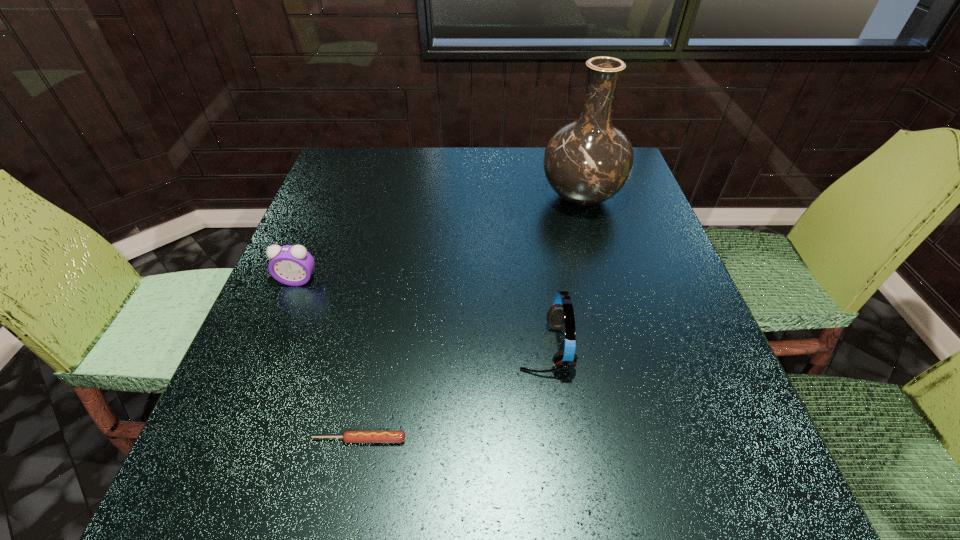
The image size is (960, 540). What are the coordinates of `free region at the left edge` in the screenshot? It's located at (322, 354).

Identify the location of vacant space at the right edge of the desktop. The width and height of the screenshot is (960, 540). (636, 245).

Find the location of `free space at the far left corner`. free space at the far left corner is located at coordinates (360, 167).

What are the coordinates of `empty location between the shortest object and the third farthest object` in the screenshot? It's located at (452, 393).

Where is `vacant area that lies between the sausage and the third shortest object`? The width and height of the screenshot is (960, 540). vacant area that lies between the sausage and the third shortest object is located at coordinates (452, 393).

Where is `empty space between the headset and the sausage`? The width and height of the screenshot is (960, 540). empty space between the headset and the sausage is located at coordinates (452, 393).

Where is `free space between the second farthest object and the tallest object`? free space between the second farthest object and the tallest object is located at coordinates (440, 239).

What are the coordinates of `vacant area that lies between the farthest object and the nearest object` in the screenshot? It's located at (470, 318).

Identify the location of vacant space that's between the headset and the third nearest object. The image size is (960, 540). (421, 314).

At what (x,y) coordinates should I click in order to perform the action: click on vacant point located between the tallest object and the sausage. Please return your answer as a coordinate pair (x, y). The height and width of the screenshot is (540, 960). Looking at the image, I should click on (470, 318).